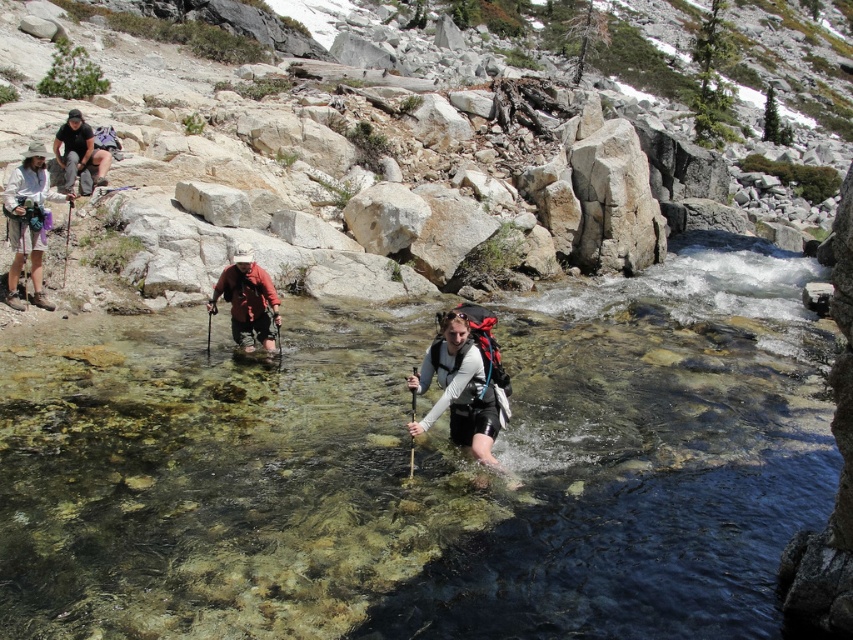
You are a hiker planning to cross the stream safely. You notice the matte black backpack at center and the matte white hat at upper left. Which item is closer to you as you approach the stream?

The matte black backpack at center is closer to you because it is in front of the matte white hat at upper left.

You are a hiker planning to follow the path taken by the group in the image. You notice the matte red jacket at center and the matte black backpack at upper left. Which object should you look for first to stay on the correct path?

The matte red jacket at center is positioned on the right side of the matte black backpack at upper left, so you should look for the matte black backpack at upper left first as it is closer to your starting point.